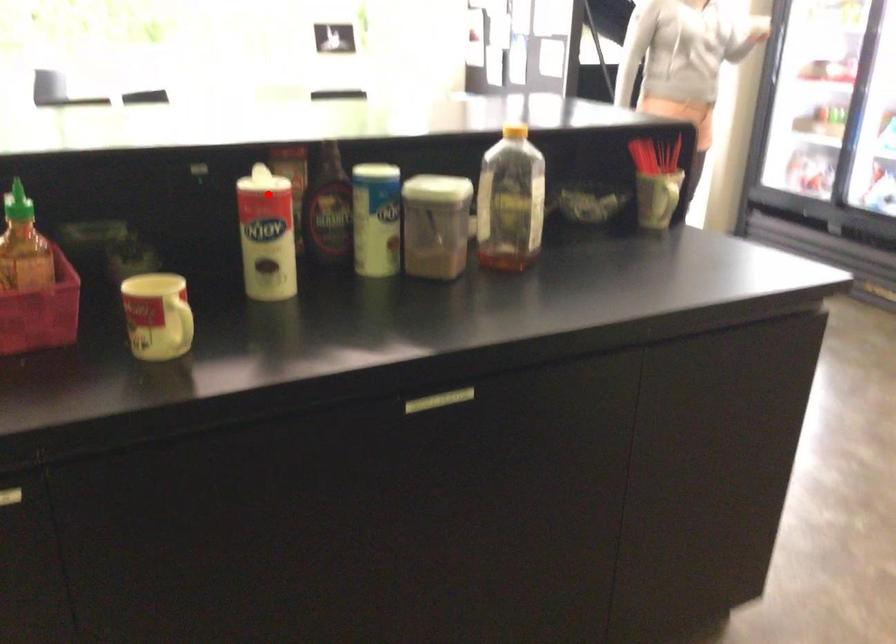
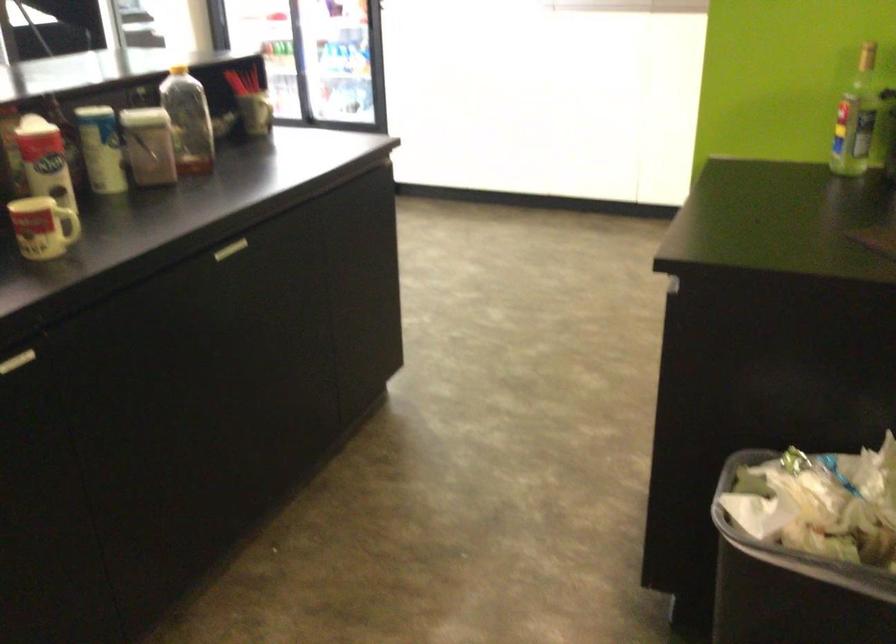
In the second image, find the point that corresponds to the highlighted location in the first image.

(16, 149)